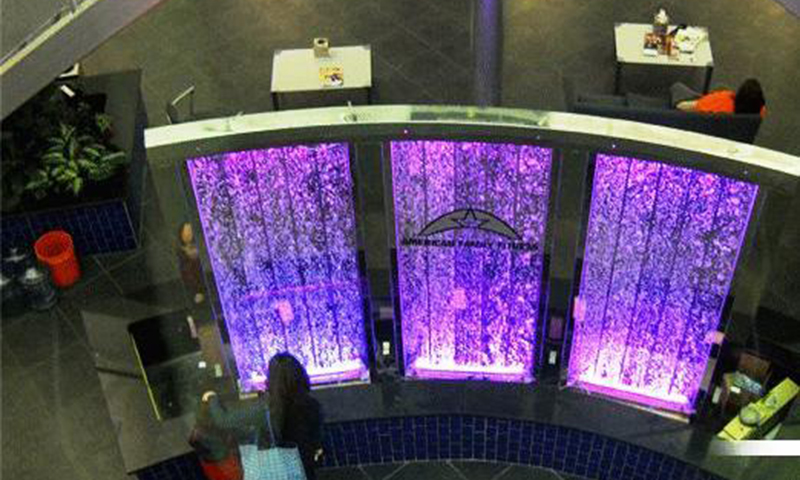
Locate an element on the screen. blue tile is located at coordinates (373, 446), (420, 427), (492, 440), (590, 458), (642, 467).